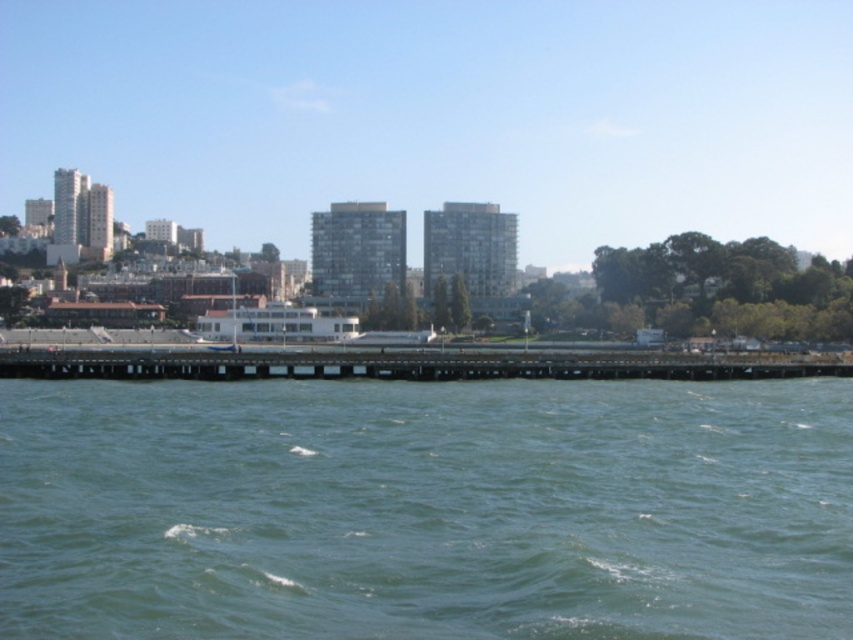
You are standing at the point with coordinates (426,509) in the image. What is located at this exact point?

The point at (426,509) is occupied by green water at center.